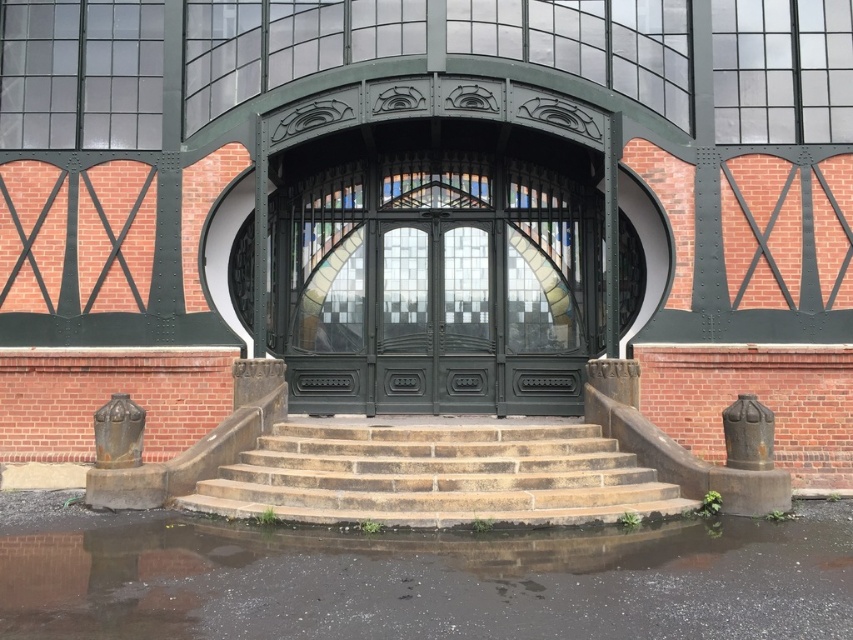
Question: Which object appears closest to the camera in this image?

Choices:
 (A) green metal/glass doors at center
 (B) brown stone stairs at center
 (C) green matte door at center

Answer: (B)

Question: Does green metal/glass doors at center appear over brown stone stairs at center?

Choices:
 (A) no
 (B) yes

Answer: (B)

Question: Does brown stone stairs at center appear under green matte door at center?

Choices:
 (A) yes
 (B) no

Answer: (A)

Question: Which point is closer to the camera taking this photo?

Choices:
 (A) (395, 326)
 (B) (393, 307)

Answer: (A)

Question: Which is nearer to the brown stone stairs at center?

Choices:
 (A) green metal/glass doors at center
 (B) green matte door at center

Answer: (B)

Question: Can you confirm if green metal/glass doors at center is bigger than brown stone stairs at center?

Choices:
 (A) no
 (B) yes

Answer: (B)